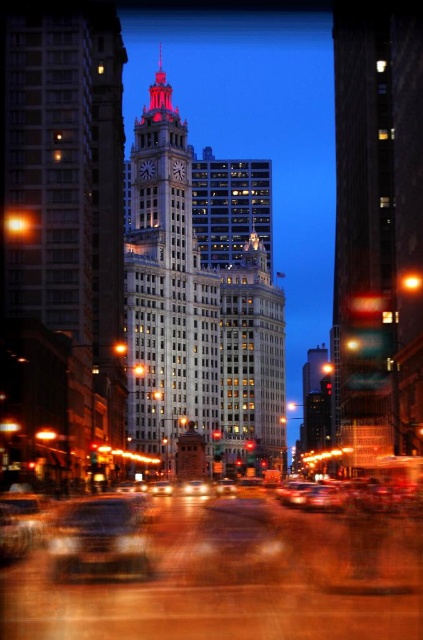
You are standing at the intersection of the city street and want to locate the white stone clock tower at center. According to the coordinates provided, where exactly is it positioned?

The white stone clock tower at center is located at coordinates point (x=200, y=298).

You are standing on the city street and want to take a photo of the illuminated building. You notice two points on the road marked as point 1 at coordinates point (137, 227) and point 2 at coordinates point (65, 513). Which point should you stand closer to in order to have the building fill more of your camera frame?

You should stand closer to point 2 at coordinates point (65, 513) because point 1 at coordinates point (137, 227) is behind it, meaning point 2 is closer to the building and will allow the building to fill more of the camera frame.